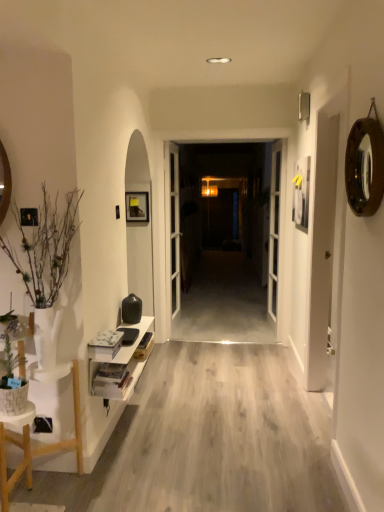
Question: In terms of width, does light wood floor at center look wider or thinner when compared to white glass door at center, the second door positioned from the left?

Choices:
 (A) thin
 (B) wide

Answer: (B)

Question: From the image's perspective, is light wood floor at center positioned above or below white glass door at center, arranged as the 1th door when viewed from the right?

Choices:
 (A) above
 (B) below

Answer: (B)

Question: Considering the real-world distances, which object is farthest from the white glossy door at center, which appears as the first door when viewed from the left?

Choices:
 (A) gold metallic mirror at upper right
 (B) white glossy shelf at lower left
 (C) light wood floor at center
 (D) white glass door at center, arranged as the 1th door when viewed from the right
 (E) white textured stool at lower left

Answer: (A)

Question: Which is farther from the white glossy door at center, which appears as the first door when viewed from the left?

Choices:
 (A) white matte vase at left
 (B) transparent glass door at center
 (C) gold metallic mirror at upper right
 (D) white glass door at center, the second door positioned from the left
 (E) light wood floor at center

Answer: (B)